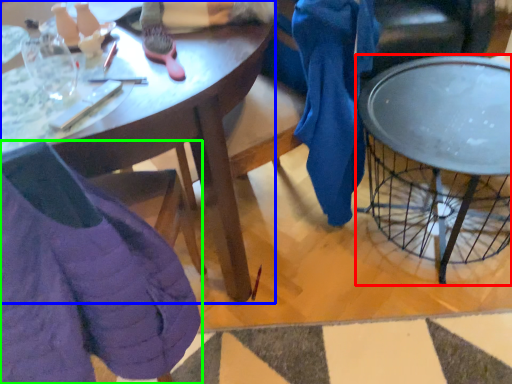
Question: Which object is positioned closest to coffee table (highlighted by a red box)? Select from desk (highlighted by a blue box) and chair (highlighted by a green box).

Choices:
 (A) desk
 (B) chair

Answer: (A)